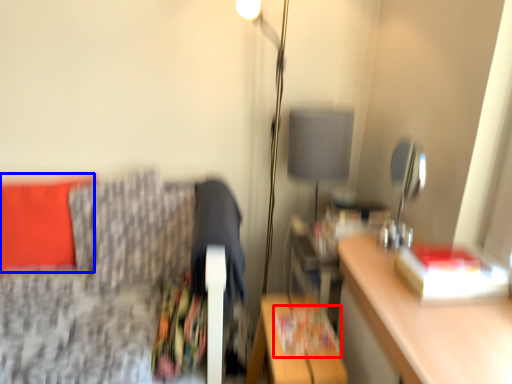
Question: Which of the following is the closest to the observer, magazine (highlighted by a red box) or pillow (highlighted by a blue box)?

Choices:
 (A) magazine
 (B) pillow

Answer: (A)